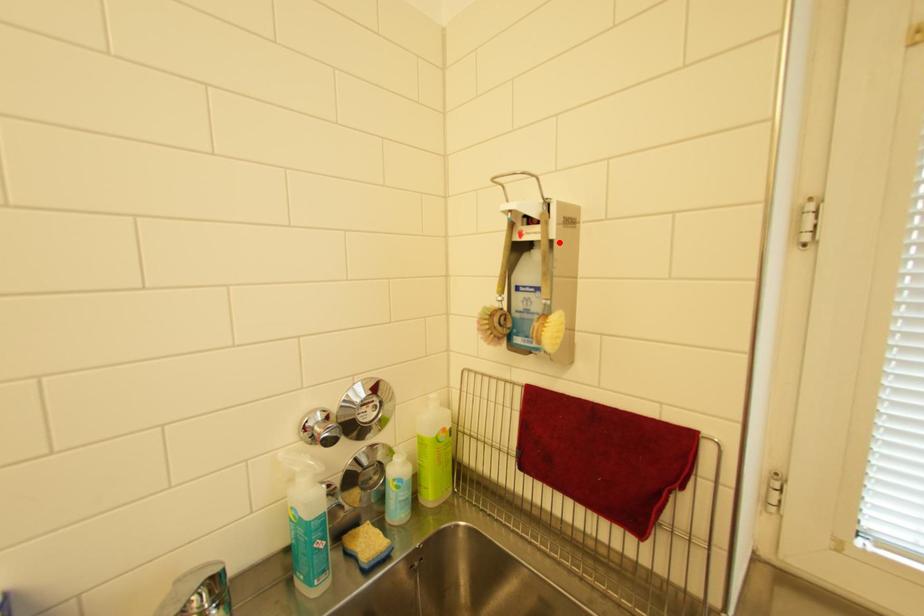
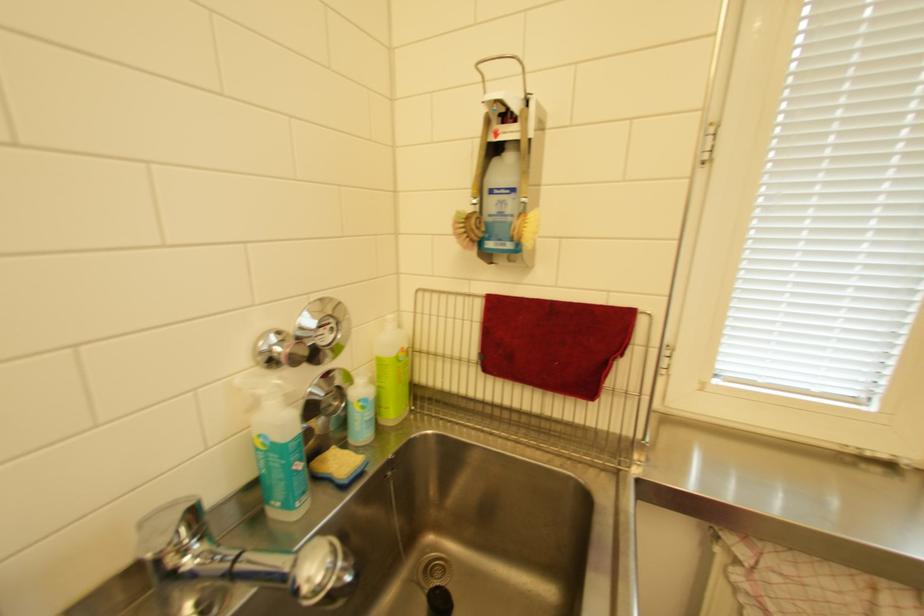
In the second image, find the point that corresponds to the highlighted location in the first image.

(537, 140)